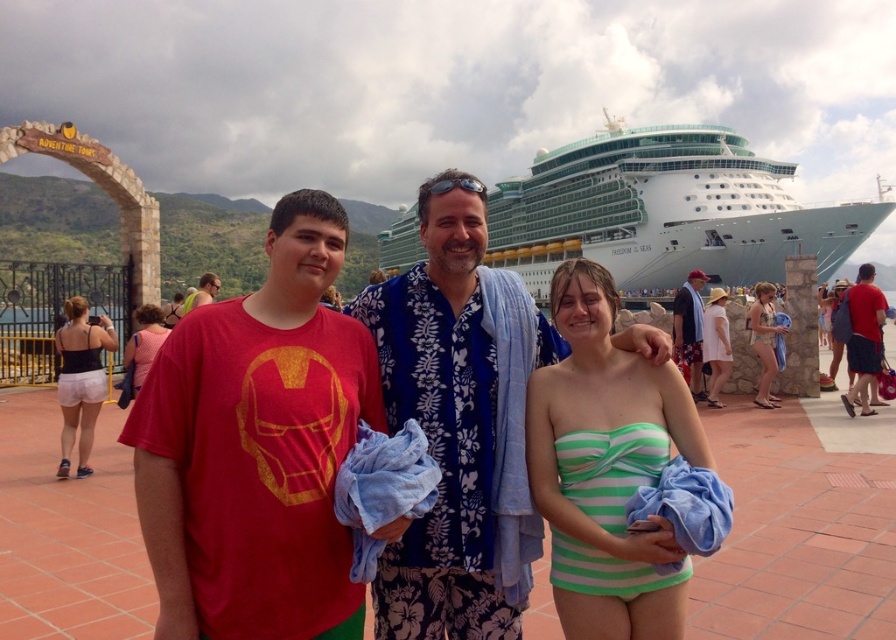
You are a photographer standing at the embarkation point. You want to take a closeup shot of the green striped bikini at center. Considering the distance, is it feasible to capture the details clearly without moving closer?

The green striped bikini at center is 56.31 meters away from the camera. At this distance, capturing clear details without moving closer would be challenging unless using a high zoom lens.

You are standing on the pier and want to take a photo of both the blue floral shirt at center and the blue floral shirt at right. The camera you have can focus on objects within a 30 meter range. Will both shirts be in focus?

The blue floral shirt at center is 28.26 meters away from the blue floral shirt at right. Since the maximum distance between them is within the 30 meter range, both shirts will be in focus.